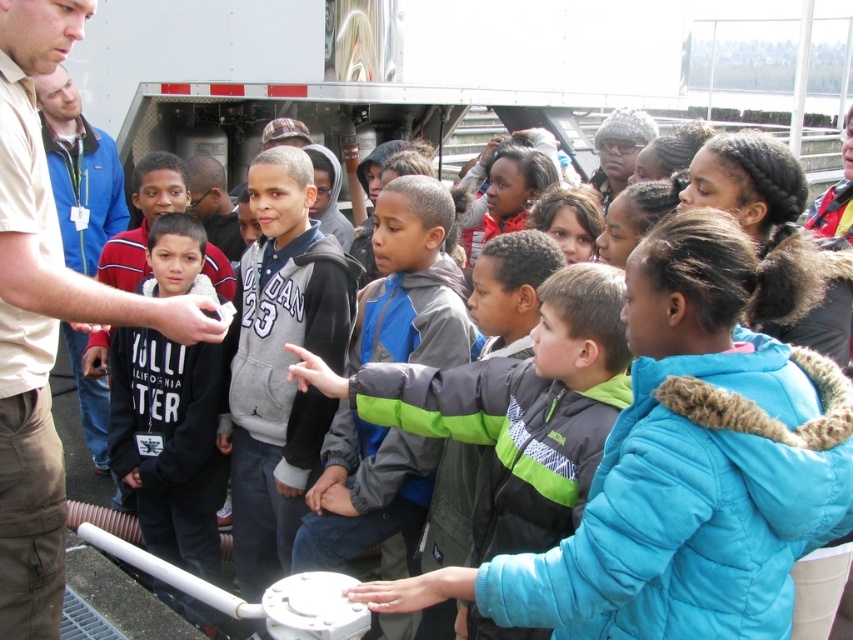
Does gray-green fleece jacket at center lie behind blue jacket at left?

No, gray-green fleece jacket at center is in front of blue jacket at left.

Is gray-green fleece jacket at center bigger than blue jacket at left?

Yes, gray-green fleece jacket at center is bigger than blue jacket at left.

Does point (413, 396) come in front of point (122, 212)?

Yes, it is in front of point (122, 212).

At what (x,y) coordinates should I click in order to perform the action: click on gray-green fleece jacket at center. Please return your answer as a coordinate pair (x, y). The height and width of the screenshot is (640, 853). Looking at the image, I should click on (515, 410).

In the scene shown: Measure the distance between point (x=664, y=358) and camera.

A distance of 8.14 feet exists between point (x=664, y=358) and camera.

Which is behind, point (679, 592) or point (27, 579)?

Point (27, 579)

Locate an element on the screen. This screenshot has height=640, width=853. blue fuzzy jacket at center is located at coordinates (689, 460).

Consider the image. Which is below, blue fuzzy jacket at center or gray-green fleece jacket at center?

gray-green fleece jacket at center is below.

Can you confirm if blue fuzzy jacket at center is bigger than gray-green fleece jacket at center?

Indeed, blue fuzzy jacket at center has a larger size compared to gray-green fleece jacket at center.

Identify the location of blue fuzzy jacket at center. The image size is (853, 640). (689, 460).